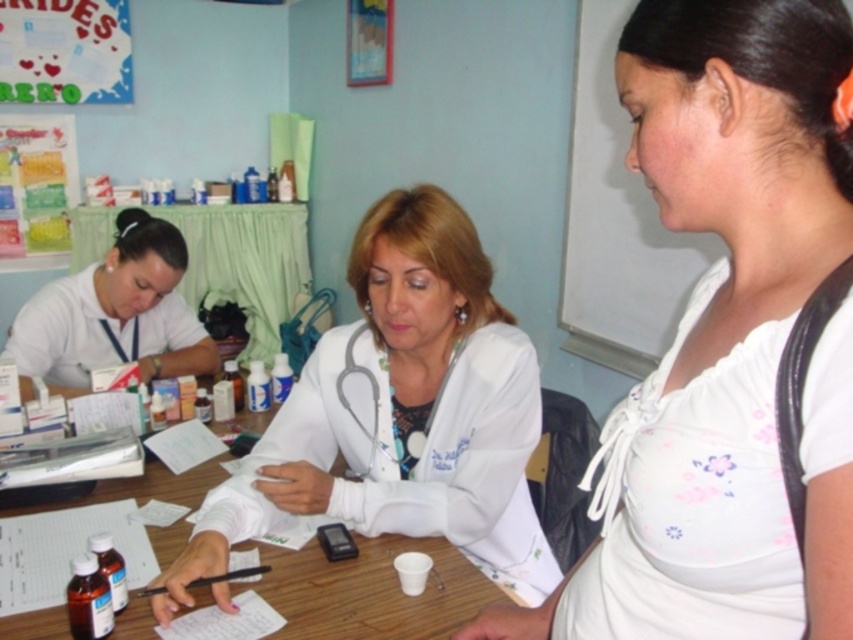
Which is below, white glossy stethoscope at upper left or white paper at left?

white glossy stethoscope at upper left is below.

Can you confirm if white glossy stethoscope at upper left is smaller than white paper at left?

Yes.

Does point (178, 332) lie in front of point (195, 296)?

That is True.

The height and width of the screenshot is (640, 853). Identify the location of white glossy stethoscope at upper left. (113, 314).

Which is behind, point (796, 237) or point (305, 420)?

The point (305, 420) is more distant.

Is white cotton shirt at center positioned behind white matte lab coat at center?

That is False.

I want to click on white cotton shirt at center, so click(727, 340).

You are a GUI agent. You are given a task and a screenshot of the screen. Output one action in this format:
    pyautogui.click(x=<x>, y=<y>)
    Task: Click on the wooden table at center
    
    Given the screenshot: What is the action you would take?
    pyautogui.click(x=369, y=589)

You are a GUI agent. You are given a task and a screenshot of the screen. Output one action in this format:
    pyautogui.click(x=<x>, y=<y>)
    Task: Click on the wooden table at center
    
    Given the screenshot: What is the action you would take?
    click(x=369, y=589)